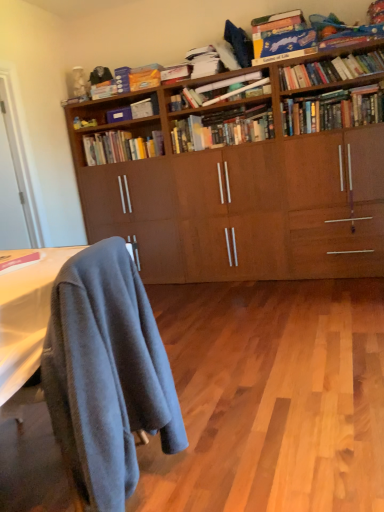
Find the location of a particular element. The width and height of the screenshot is (384, 512). matte pink book at lower left, which ranks as the first book in bottom-to-top order is located at coordinates (20, 260).

Describe the element at coordinates (217, 90) in the screenshot. The height and width of the screenshot is (512, 384). I see `matte paper book at center, which is counted as the 7th book, starting from the top` at that location.

Locate an element on the screen. matte cardboard box at upper center, which appears as the eighth book when ordered from the bottom is located at coordinates (175, 73).

From a real-world perspective, between matte paper book at center, which is counted as the 5th book, starting from the bottom, and hardcover books at center, arranged as the 3th book when ordered from the bottom, who is vertically lower?

In real-world perspective, hardcover books at center, arranged as the 3th book when ordered from the bottom, is lower.

Is hardcover books at center, the ninth book viewed from the top, at the back of matte paper book at center, which is counted as the 5th book, starting from the bottom?

That's not correct — matte paper book at center, which is counted as the 5th book, starting from the bottom, is not looking away from hardcover books at center, the ninth book viewed from the top.

Considering the sizes of matte paper book at center, which is counted as the 5th book, starting from the bottom, and hardcover books at center, the ninth book viewed from the top, in the image, is matte paper book at center, which is counted as the 5th book, starting from the bottom, taller or shorter than hardcover books at center, the ninth book viewed from the top,?

Considering their sizes, matte paper book at center, which is counted as the 5th book, starting from the bottom, has less height than hardcover books at center, the ninth book viewed from the top.

Considering the points (165, 72) and (4, 256), which point is in front, point (165, 72) or point (4, 256)?

Point (4, 256)

Measure the distance from matte cardboard box at upper center, the fourth book from the top, to matte pink book at lower left, which ranks as the first book in bottom-to-top order.

8.40 feet.

From the image's perspective, count 7th books upward from the matte pink book at lower left, the eleventh book from the top, and point to it. Please provide its 2D coordinates.

[(175, 73)]

Is point (298, 131) closer to camera compared to point (285, 22)?

No.

Can you tell me how much hardcover books at upper right, marked as the 8th book in a top-to-bottom arrangement, and blue cardboard game at upper right, the tenth book ordered from the bottom, differ in facing direction?

They differ by 2.27 degrees in their facing directions.

Can you confirm if hardcover books at upper right, which appears as the 4th book when ordered from the bottom, is positioned to the left of blue cardboard game at upper right, the tenth book ordered from the bottom?

In fact, hardcover books at upper right, which appears as the 4th book when ordered from the bottom, is to the right of blue cardboard game at upper right, the tenth book ordered from the bottom.

From a real-world perspective, which object stands above the other?

From a 3D spatial view, blue cardboard game at upper right, placed as the second book when sorted from top to bottom, is above.

Is blue cardboard book at upper right, which is counted as the ninth book, starting from the bottom, surrounded by blue cardboard game at upper right, placed as the second book when sorted from top to bottom?

No, blue cardboard book at upper right, which is counted as the ninth book, starting from the bottom, is not a part of blue cardboard game at upper right, placed as the second book when sorted from top to bottom.

Can you tell me how much blue cardboard game at upper right, placed as the second book when sorted from top to bottom, and blue cardboard book at upper right, which is the third book in top-to-bottom order, differ in facing direction?

3.41 degrees.

Based on the photo, does blue cardboard game at upper right, the tenth book ordered from the bottom, have a larger size compared to blue cardboard book at upper right, which is counted as the ninth book, starting from the bottom?

Yes, blue cardboard game at upper right, the tenth book ordered from the bottom, is bigger than blue cardboard book at upper right, which is counted as the ninth book, starting from the bottom.

Does point (138, 138) come in front of point (179, 74)?

No, (138, 138) is behind (179, 74).

Could you tell me if hardcover books at center, which is the 2th book in bottom-to-top order, is turned towards matte cardboard box at upper center, the fourth book from the top?

No, hardcover books at center, which is the 2th book in bottom-to-top order, is not facing towards matte cardboard box at upper center, the fourth book from the top.

The width and height of the screenshot is (384, 512). I want to click on the 1st book to the left of the matte cardboard box at upper center, which appears as the eighth book when ordered from the bottom, starting your count from the anchor, so click(121, 147).

Can you confirm if hardcover books at center, arranged as the 10th book when viewed from the top, is wider than matte cardboard box at upper center, which appears as the eighth book when ordered from the bottom?

Yes.

In terms of height, does blue cardboard book at upper right, which is counted as the ninth book, starting from the bottom, look taller or shorter compared to matte blue paperback book at upper center?

Clearly, blue cardboard book at upper right, which is counted as the ninth book, starting from the bottom, is shorter compared to matte blue paperback book at upper center.

In the image, is blue cardboard book at upper right, which is the third book in top-to-bottom order, on the left side or the right side of matte blue paperback book at upper center?

blue cardboard book at upper right, which is the third book in top-to-bottom order, is positioned on matte blue paperback book at upper center's right side.

Considering the sizes of objects blue cardboard book at upper right, which is counted as the ninth book, starting from the bottom, and matte blue paperback book at upper center in the image provided, who is thinner, blue cardboard book at upper right, which is counted as the ninth book, starting from the bottom, or matte blue paperback book at upper center?

With smaller width is matte blue paperback book at upper center.

Consider the image. Is blue fuzzy blanket at lower left bigger than matte cardboard box at upper center, which appears as the eighth book when ordered from the bottom?

Yes.

From a real-world perspective, between blue fuzzy blanket at lower left and matte cardboard box at upper center, the fourth book from the top, who is vertically higher?

In real-world perspective, matte cardboard box at upper center, the fourth book from the top, is above.

Between blue fuzzy blanket at lower left and matte cardboard box at upper center, the fourth book from the top, which one appears on the right side from the viewer's perspective?

matte cardboard box at upper center, the fourth book from the top.

Could you tell me if blue fuzzy blanket at lower left is turned towards matte cardboard box at upper center, which appears as the eighth book when ordered from the bottom?

No, blue fuzzy blanket at lower left is not aimed at matte cardboard box at upper center, which appears as the eighth book when ordered from the bottom.

The height and width of the screenshot is (512, 384). Identify the location of the 1st book behind the matte paper book at center, which is counted as the 5th book, starting from the bottom, starting your count from the anchor. pyautogui.click(x=223, y=128).

Locate an element on the screen. The width and height of the screenshot is (384, 512). the 8th book located beneath the matte cardboard box at upper center, the fourth book from the top (from a real-world perspective) is located at coordinates (20, 260).

From the image, which object appears to be farther from hardcover books at center, the ninth book viewed from the top, matte blue paperback book at upper center or matte pink book at lower left, which ranks as the first book in bottom-to-top order?

Based on the image, matte pink book at lower left, which ranks as the first book in bottom-to-top order, appears to be further to hardcover books at center, the ninth book viewed from the top.

Estimate the real-world distances between objects in this image. Which object is further from hardcover books at upper right, arranged as the 6th book when viewed from the top, blue cardboard book at upper right, the eleventh book ordered from the bottom, or hardcover books at upper right, which appears as the 4th book when ordered from the bottom?

hardcover books at upper right, which appears as the 4th book when ordered from the bottom.

Based on their spatial positions, is matte pink book at lower left, which ranks as the first book in bottom-to-top order, or blue cardboard game at upper right, placed as the second book when sorted from top to bottom, further from matte cardboard box at upper center, which appears as the 7th book when ordered from the bottom?

Among the two, matte pink book at lower left, which ranks as the first book in bottom-to-top order, is located further to matte cardboard box at upper center, which appears as the 7th book when ordered from the bottom.

Considering their positions, is matte cardboard box at upper center, the 5th book when ordered from top to bottom, positioned closer to blue cardboard game at upper right, the tenth book ordered from the bottom, than hardcover books at center, which is the 2th book in bottom-to-top order?

hardcover books at center, which is the 2th book in bottom-to-top order.

From the image, which object appears to be nearer to blue cardboard book at upper right, which is counted as the ninth book, starting from the bottom, matte paper book at center, which is counted as the 5th book, starting from the bottom, or matte cardboard box at upper center, the fourth book from the top?

Based on the image, matte paper book at center, which is counted as the 5th book, starting from the bottom, appears to be nearer to blue cardboard book at upper right, which is counted as the ninth book, starting from the bottom.

Looking at the image, which one is located further to hardcover books at center, arranged as the 10th book when viewed from the top, matte paper book at center, which is counted as the 7th book, starting from the top, or blue fuzzy blanket at lower left?

The object further to hardcover books at center, arranged as the 10th book when viewed from the top, is blue fuzzy blanket at lower left.

When comparing their distances from matte cardboard box at upper center, which appears as the 7th book when ordered from the bottom, does hardcover books at upper right, marked as the 8th book in a top-to-bottom arrangement, or hardcover books at center, the ninth book viewed from the top, seem closer?

hardcover books at center, the ninth book viewed from the top.

Based on their spatial positions, is blue cardboard book at upper right, which is the third book in top-to-bottom order, or hardcover books at upper right, the sixth book when ordered from bottom to top, further from matte cardboard box at upper center, the fourth book from the top?

Among the two, blue cardboard book at upper right, which is the third book in top-to-bottom order, is located further to matte cardboard box at upper center, the fourth book from the top.

In order to click on bookcase between matte cardboard box at upper center, which appears as the eighth book when ordered from the bottom, and hardcover books at upper right, the sixth book when ordered from bottom to top, from left to right in this screenshot , I will do `click(247, 180)`.

I want to click on bookcase between matte pink book at lower left, which ranks as the first book in bottom-to-top order, and matte blue paperback book at upper center from front to back, so pyautogui.click(x=247, y=180).

This screenshot has width=384, height=512. In order to click on paperback book situated between matte cardboard box at upper center, which appears as the 7th book when ordered from the bottom, and hardcover books at upper right, the sixth book when ordered from bottom to top, from left to right in this screenshot , I will do `click(119, 115)`.

The width and height of the screenshot is (384, 512). In order to click on paperback book between blue fuzzy blanket at lower left and matte cardboard box at upper center, which appears as the 7th book when ordered from the bottom, in the front-back direction in this screenshot , I will do `click(119, 115)`.